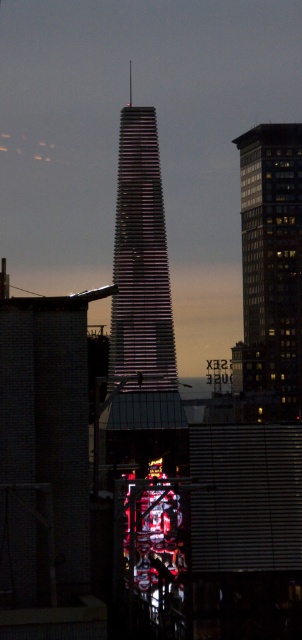
Question: Which point is farther from the camera taking this photo?

Choices:
 (A) (131, 118)
 (B) (291, 308)

Answer: (A)

Question: Can you confirm if glassy reflective skyscraper at right is positioned to the right of shiny glass tower at center?

Choices:
 (A) yes
 (B) no

Answer: (A)

Question: In this image, where is glassy reflective skyscraper at right located relative to shiny glass tower at center?

Choices:
 (A) left
 (B) right

Answer: (B)

Question: Does glassy reflective skyscraper at right have a lesser width compared to shiny glass tower at center?

Choices:
 (A) yes
 (B) no

Answer: (B)